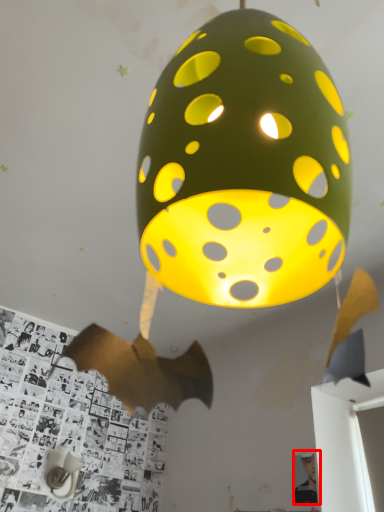
Question: From the image's perspective, considering the relative positions of person (annotated by the red box) and table lamp in the image provided, where is person (annotated by the red box) located with respect to the staircase?

Choices:
 (A) above
 (B) below

Answer: (A)